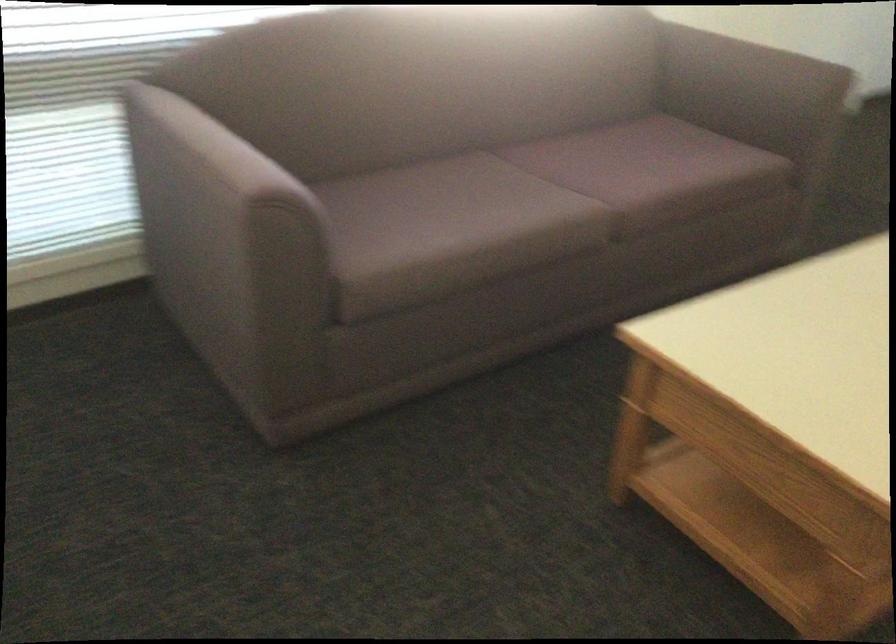
This screenshot has height=644, width=896. Describe the element at coordinates (528, 205) in the screenshot. I see `a sofa sitting surface` at that location.